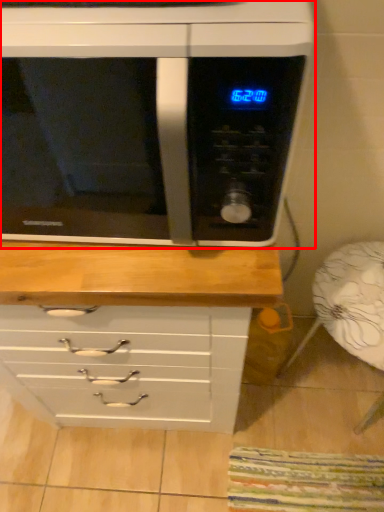
Question: In this image, where is microwave oven (annotated by the red box) located relative to armchair?

Choices:
 (A) left
 (B) right

Answer: (A)